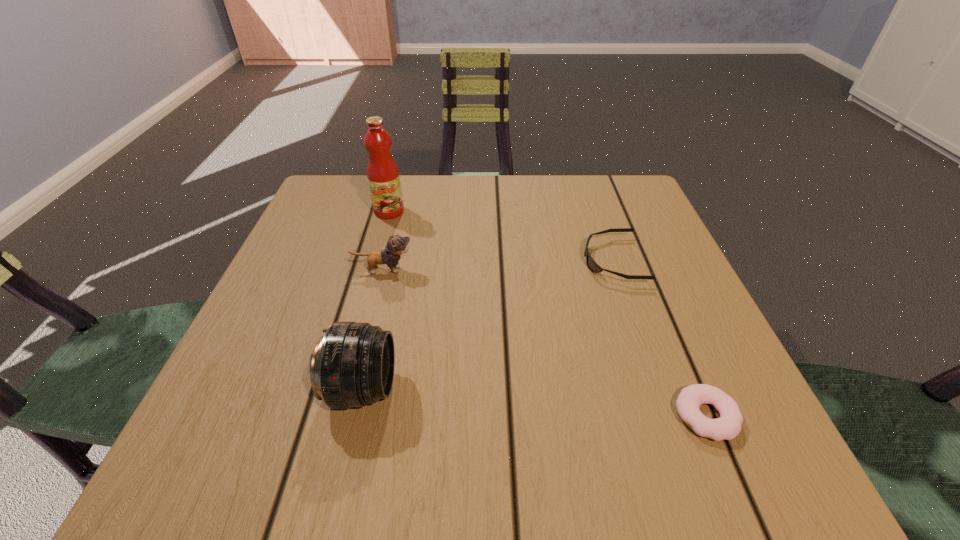
Locate an element on the screen. This screenshot has height=540, width=960. the farthest object is located at coordinates (383, 176).

Image resolution: width=960 pixels, height=540 pixels. Identify the location of the tallest object. (383, 176).

The image size is (960, 540). I want to click on the fourth shortest object, so click(353, 364).

What are the coordinates of `kitten` in the screenshot? It's located at (396, 245).

In order to click on sunglasses in this screenshot , I will do `click(592, 265)`.

Find the location of `doughnut`. doughnut is located at coordinates (728, 426).

Identify the location of vacant space located on the front label of the tallest object. The width and height of the screenshot is (960, 540). (371, 280).

The width and height of the screenshot is (960, 540). What are the coordinates of `blank space located at the front element of the fourth shortest object` in the screenshot? It's located at (660, 389).

Locate an element on the screen. free point located on the front-facing side of the kitten is located at coordinates (546, 270).

What are the coordinates of `free location located 0.310m on the front-facing side of the sunglasses` in the screenshot? It's located at (430, 260).